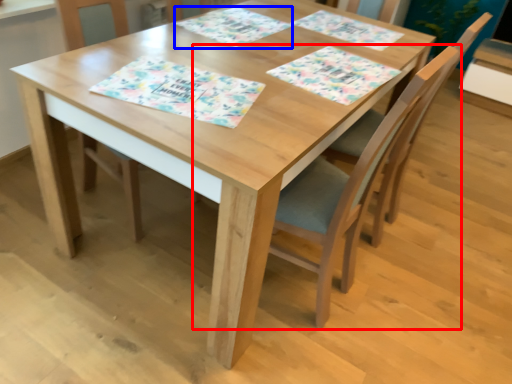
Question: Among these objects, which one is nearest to the camera, chair (highlighted by a red box) or place mat (highlighted by a blue box)?

Choices:
 (A) chair
 (B) place mat

Answer: (A)